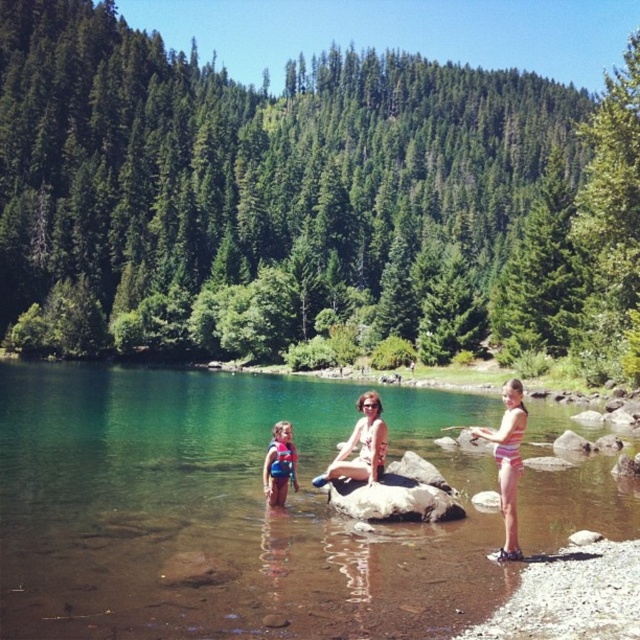
Question: Which object is positioned farthest from the striped swimsuit at right?

Choices:
 (A) clear water at center
 (B) red life vest at center

Answer: (A)

Question: Does striped swimsuit at right appear on the right side of matte white bikini at center?

Choices:
 (A) no
 (B) yes

Answer: (B)

Question: Which point is farther to the camera?

Choices:
 (A) (220, 452)
 (B) (348, 454)

Answer: (A)

Question: Which of the following is the farthest from the observer?

Choices:
 (A) pos(269,476)
 (B) pos(355,477)
 (C) pos(250,404)
 (D) pos(513,424)

Answer: (C)

Question: In this image, where is striped swimsuit at right located relative to matte white bikini at center?

Choices:
 (A) right
 (B) left

Answer: (A)

Question: Is striped swimsuit at right thinner than matte white bikini at center?

Choices:
 (A) no
 (B) yes

Answer: (A)